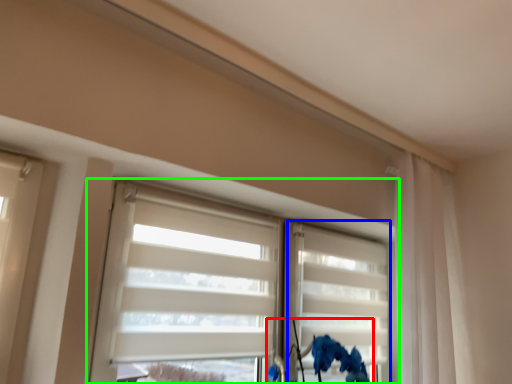
Question: Which is nearer to the floral arrangement (highlighted by a red box)? shutter (highlighted by a blue box) or window (highlighted by a green box).

Choices:
 (A) shutter
 (B) window

Answer: (A)